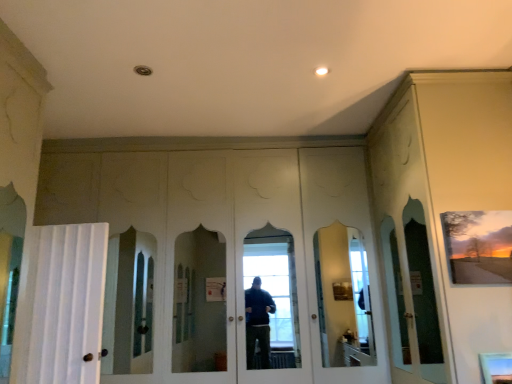
Question: Can you confirm if white fabric curtain at left is positioned to the right of matte glass window at lower right?

Choices:
 (A) yes
 (B) no

Answer: (B)

Question: Is white fabric curtain at left facing towards matte glass window at lower right?

Choices:
 (A) yes
 (B) no

Answer: (B)

Question: Can you confirm if white fabric curtain at left is taller than matte glass window at lower right?

Choices:
 (A) yes
 (B) no

Answer: (A)

Question: From the image's perspective, is white fabric curtain at left beneath matte glass window at lower right?

Choices:
 (A) yes
 (B) no

Answer: (B)

Question: Is white fabric curtain at left positioned behind matte glass window at lower right?

Choices:
 (A) no
 (B) yes

Answer: (B)

Question: Is white fabric curtain at left to the left or to the right of matte wooden picture frame at upper right in the image?

Choices:
 (A) right
 (B) left

Answer: (B)

Question: In the image, is white fabric curtain at left positioned in front of or behind matte wooden picture frame at upper right?

Choices:
 (A) front
 (B) behind

Answer: (B)

Question: From the image's perspective, is white fabric curtain at left above or below matte wooden picture frame at upper right?

Choices:
 (A) below
 (B) above

Answer: (A)

Question: From a real-world perspective, relative to matte wooden picture frame at upper right, is white fabric curtain at left vertically above or below?

Choices:
 (A) below
 (B) above

Answer: (A)

Question: Considering the positions of matte glass window at lower right and white fabric curtain at left in the image, is matte glass window at lower right wider or thinner than white fabric curtain at left?

Choices:
 (A) thin
 (B) wide

Answer: (A)

Question: From a real-world perspective, is matte glass window at lower right physically located above or below white fabric curtain at left?

Choices:
 (A) above
 (B) below

Answer: (B)

Question: In terms of size, does matte glass window at lower right appear bigger or smaller than white fabric curtain at left?

Choices:
 (A) big
 (B) small

Answer: (B)

Question: Visually, is matte glass window at lower right positioned to the left or to the right of white fabric curtain at left?

Choices:
 (A) right
 (B) left

Answer: (A)

Question: From the image's perspective, is matte wooden picture frame at upper right located above or below matte glass window at lower right?

Choices:
 (A) above
 (B) below

Answer: (A)

Question: Is matte wooden picture frame at upper right bigger or smaller than matte glass window at lower right?

Choices:
 (A) big
 (B) small

Answer: (A)